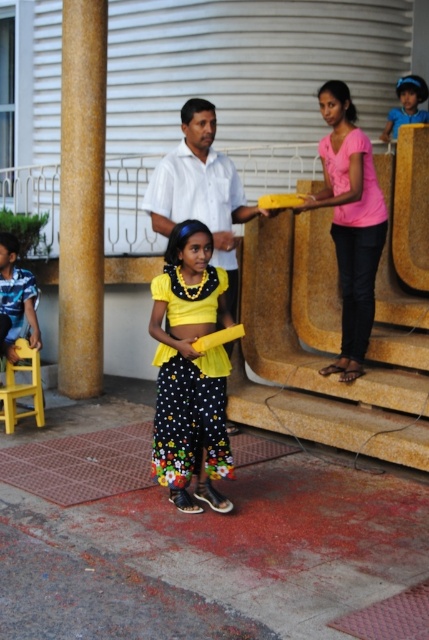
Is yellow fabric shirt at left further to the viewer compared to brown leather sandal at lower center?

That is True.

Between yellow fabric shirt at left and brown leather sandal at lower center, which one has more height?

With more height is yellow fabric shirt at left.

What are the coordinates of `yellow fabric shirt at left` in the screenshot? It's located at (17, 298).

Locate an element on the screen. The height and width of the screenshot is (640, 429). yellow fabric shirt at left is located at coordinates (17, 298).

Does yellow fabric dress at center appear under white matte shirt at center?

Yes.

This screenshot has height=640, width=429. Describe the element at coordinates (190, 417) in the screenshot. I see `yellow fabric dress at center` at that location.

Where is `yellow fabric dress at center`? yellow fabric dress at center is located at coordinates (190, 417).

Does yellow fabric dress at center have a lesser height compared to blue fabric hat at upper right?

No, yellow fabric dress at center is not shorter than blue fabric hat at upper right.

Is yellow fabric dress at center closer to camera compared to blue fabric hat at upper right?

Yes, yellow fabric dress at center is in front of blue fabric hat at upper right.

Is point (193, 468) positioned before point (425, 88)?

Yes, point (193, 468) is closer to viewer.

Where is `yellow fabric dress at center`? Image resolution: width=429 pixels, height=640 pixels. yellow fabric dress at center is located at coordinates (190, 417).